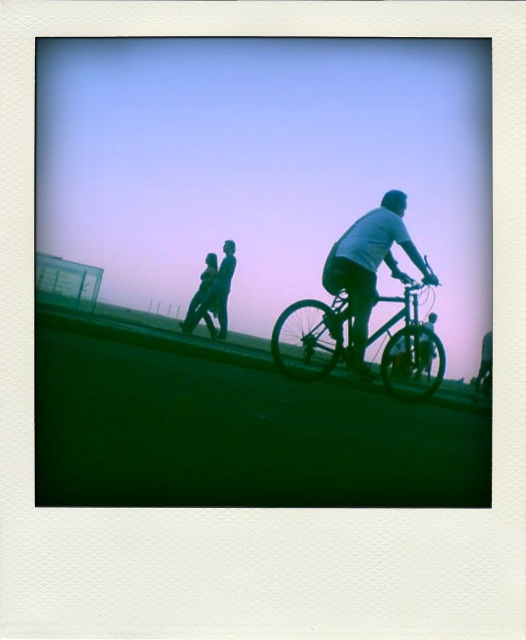
Question: Is metallic silver bicycle at center positioned at the back of matte white shirt at right?

Choices:
 (A) no
 (B) yes

Answer: (A)

Question: Which object is farther from the camera taking this photo?

Choices:
 (A) metallic silver bicycle at center
 (B) matte white shirt at right

Answer: (B)

Question: Does metallic silver bicycle at center appear on the left side of matte white shirt at right?

Choices:
 (A) yes
 (B) no

Answer: (B)

Question: Which object is closer to the camera taking this photo?

Choices:
 (A) metallic silver bicycle at center
 (B) matte white shirt at right

Answer: (A)

Question: Which point is farther to the camera?

Choices:
 (A) (369, 308)
 (B) (295, 353)

Answer: (A)

Question: Is metallic silver bicycle at center closer to the viewer compared to matte white shirt at right?

Choices:
 (A) yes
 (B) no

Answer: (A)